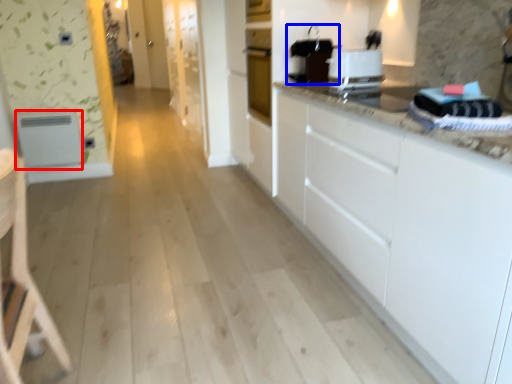
Question: Which object is closer to the camera taking this photo, appliance (highlighted by a red box) or appliance (highlighted by a blue box)?

Choices:
 (A) appliance
 (B) appliance

Answer: (B)